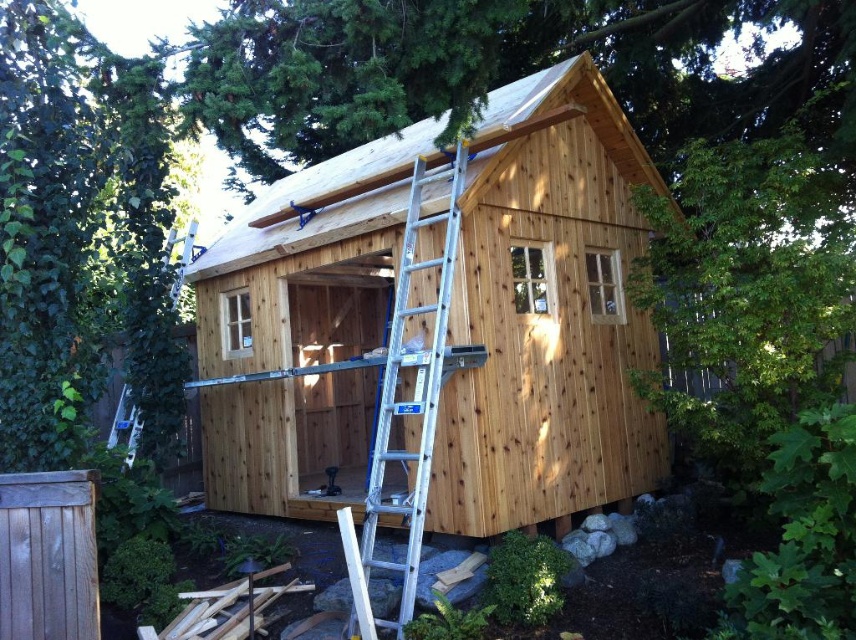
Is natural wood cabin at center positioned in front of silver aluminum ladder at center?

No, natural wood cabin at center is further to the viewer.

Image resolution: width=856 pixels, height=640 pixels. Describe the element at coordinates (547, 314) in the screenshot. I see `natural wood cabin at center` at that location.

Image resolution: width=856 pixels, height=640 pixels. I want to click on natural wood cabin at center, so (x=547, y=314).

Image resolution: width=856 pixels, height=640 pixels. Describe the element at coordinates (547, 314) in the screenshot. I see `natural wood cabin at center` at that location.

Between point (503, 378) and point (415, 125), which one is positioned behind?

The point (415, 125) is behind.

This screenshot has width=856, height=640. What are the coordinates of `natural wood cabin at center` in the screenshot? It's located at (547, 314).

Who is shorter, natural wood roof at upper center or silver aluminum ladder at center?

natural wood roof at upper center is shorter.

Does point (206, 269) come closer to viewer compared to point (459, 209)?

No.

In order to click on natural wood roof at upper center in this screenshot , I will do `click(322, 204)`.

The height and width of the screenshot is (640, 856). In order to click on natural wood roof at upper center in this screenshot , I will do `click(322, 204)`.